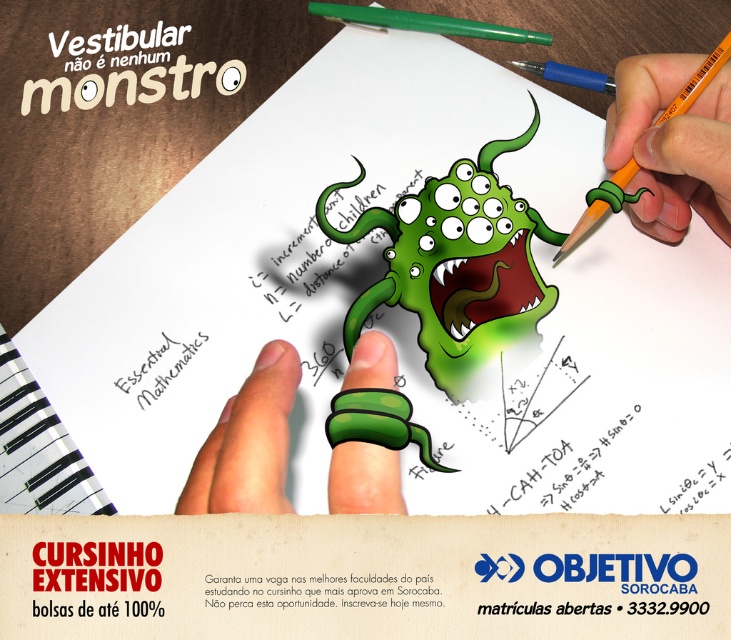
Consider the image. Who is shorter, green matte monster at center or green rubber band at center?

With less height is green rubber band at center.

Is green matte monster at center behind green rubber band at center?

Yes, green matte monster at center is further from the viewer.

What do you see at coordinates (455, 262) in the screenshot? I see `green matte monster at center` at bounding box center [455, 262].

In order to click on green matte monster at center in this screenshot , I will do `click(455, 262)`.

Which is more to the left, green plastic pencil at upper center or blue plastic pencil at upper center?

green plastic pencil at upper center is more to the left.

Does green plastic pencil at upper center appear over blue plastic pencil at upper center?

Yes, green plastic pencil at upper center is above blue plastic pencil at upper center.

Locate an element on the screen. green plastic pencil at upper center is located at coordinates (424, 22).

Is green matte monster at center shorter than blue plastic pencil at upper center?

In fact, green matte monster at center may be taller than blue plastic pencil at upper center.

Is green matte monster at center above blue plastic pencil at upper center?

No, green matte monster at center is not above blue plastic pencil at upper center.

Is point (529, 278) farther from viewer compared to point (588, 83)?

That is False.

Find the location of a particular element. The image size is (731, 640). green matte monster at center is located at coordinates (455, 262).